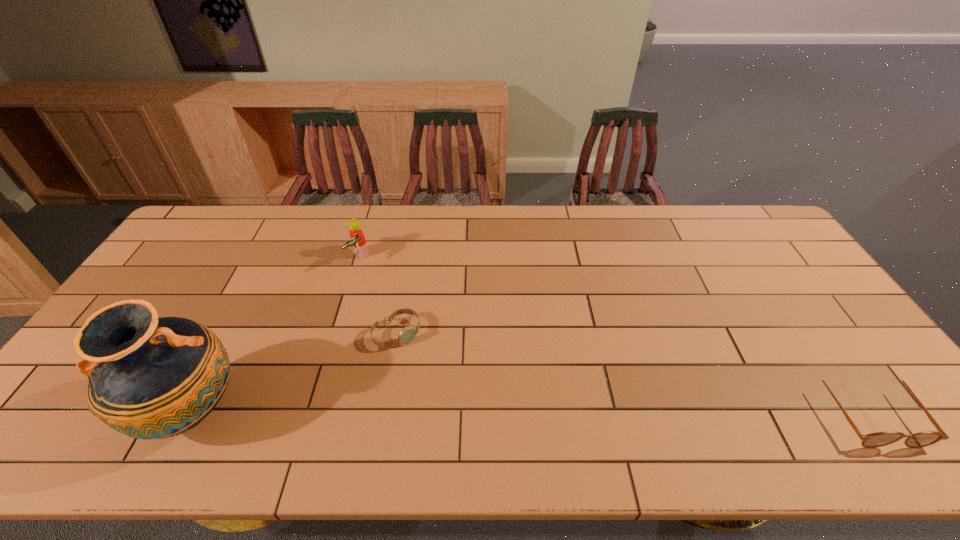
This screenshot has height=540, width=960. I want to click on vacant area situated in front of the Lego with the accessory visible, so coord(372,275).

What are the coordinates of `free space located on the face of the third object from left to right` in the screenshot? It's located at coord(429,368).

Locate an element on the screen. This screenshot has width=960, height=540. free space located on the face of the third object from left to right is located at coordinates (431, 371).

I want to click on free space located 0.070m on the face of the third object from left to right, so click(x=424, y=363).

Locate an element on the screen. The width and height of the screenshot is (960, 540). object that is at the far edge is located at coordinates (357, 238).

This screenshot has height=540, width=960. What are the coordinates of `pottery that is positioned at the near edge` in the screenshot? It's located at (150, 378).

You are a GUI agent. You are given a task and a screenshot of the screen. Output one action in this format:
    pyautogui.click(x=<x>, y=<y>)
    Task: Click on the sunglasses at the near edge
    This screenshot has width=960, height=540.
    Given the screenshot: What is the action you would take?
    pyautogui.click(x=878, y=439)

Find the location of a particular element. This screenshot has height=540, width=960. object that is at the right edge is located at coordinates (878, 439).

This screenshot has width=960, height=540. In order to click on object present at the near right corner in this screenshot , I will do `click(878, 439)`.

I want to click on free region at the far edge of the desktop, so click(x=519, y=219).